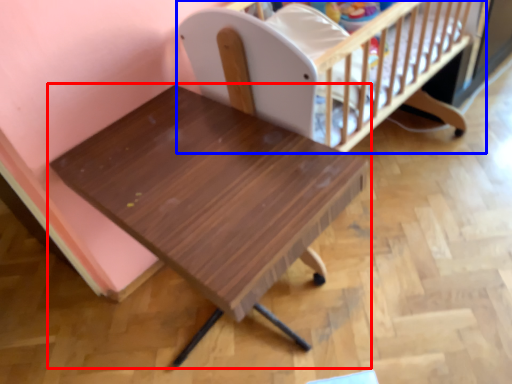
Question: Which point is closer to the camera, table (highlighted by a red box) or infant bed (highlighted by a blue box)?

Choices:
 (A) table
 (B) infant bed

Answer: (A)